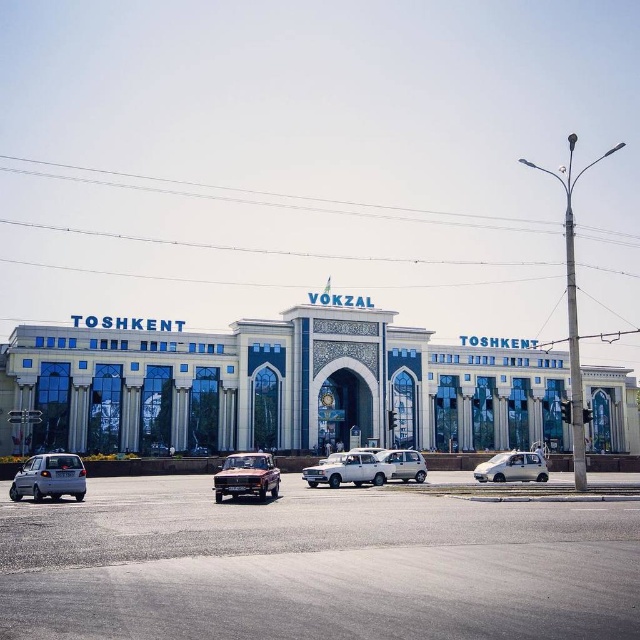
Question: Which point appears farthest from the camera in this image?

Choices:
 (A) (317, 481)
 (B) (44, 467)

Answer: (A)

Question: Which point is farther to the camera?

Choices:
 (A) silver metallic hatchback at lower left
 (B) white matte sedan at center
 (C) silver metallic car at center

Answer: (C)

Question: Is rustic metallic car at center below satin silver sedan at center?

Choices:
 (A) no
 (B) yes

Answer: (B)

Question: Which object is the farthest from the silver metallic car at center?

Choices:
 (A) white matte sedan at center
 (B) satin silver sedan at center

Answer: (A)

Question: Considering the relative positions of silver metallic hatchback at lower left and silver metallic car at center in the image provided, where is silver metallic hatchback at lower left located with respect to silver metallic car at center?

Choices:
 (A) left
 (B) right

Answer: (A)

Question: Does white glass building at center appear on the right side of silver metallic hatchback at lower left?

Choices:
 (A) yes
 (B) no

Answer: (A)